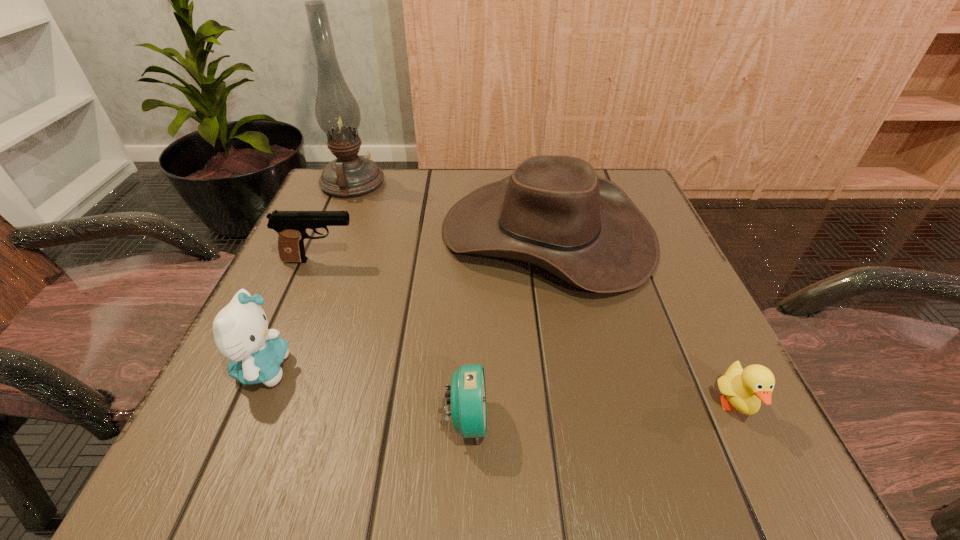
The image size is (960, 540). I want to click on the tallest object, so click(337, 112).

Locate an element on the screen. This screenshot has height=540, width=960. cowboy hat is located at coordinates (553, 211).

Image resolution: width=960 pixels, height=540 pixels. Find the location of `kitten`. kitten is located at coordinates (240, 329).

At what (x,y) coordinates should I click in order to perform the action: click on pistol. Please return your answer as a coordinate pair (x, y). The width and height of the screenshot is (960, 540). Looking at the image, I should click on (x=291, y=226).

This screenshot has width=960, height=540. Find the location of `alarm clock`. alarm clock is located at coordinates (468, 395).

The image size is (960, 540). Find the location of `duckling`. duckling is located at coordinates (745, 389).

Find the location of a particular element. The height and width of the screenshot is (540, 960). vacant position located 0.350m on the right of the tallest object is located at coordinates (528, 183).

Where is `vacant space situated on the front of the cowboy hat`? vacant space situated on the front of the cowboy hat is located at coordinates (582, 416).

Identify the location of vacant space located on the face of the kitten. (363, 368).

You are a GUI agent. You are given a task and a screenshot of the screen. Output one action in this format:
    pyautogui.click(x=<x>, y=<y>)
    Task: Click on the vacant space located at the barrel of the pistol
    
    Given the screenshot: What is the action you would take?
    pyautogui.click(x=425, y=260)